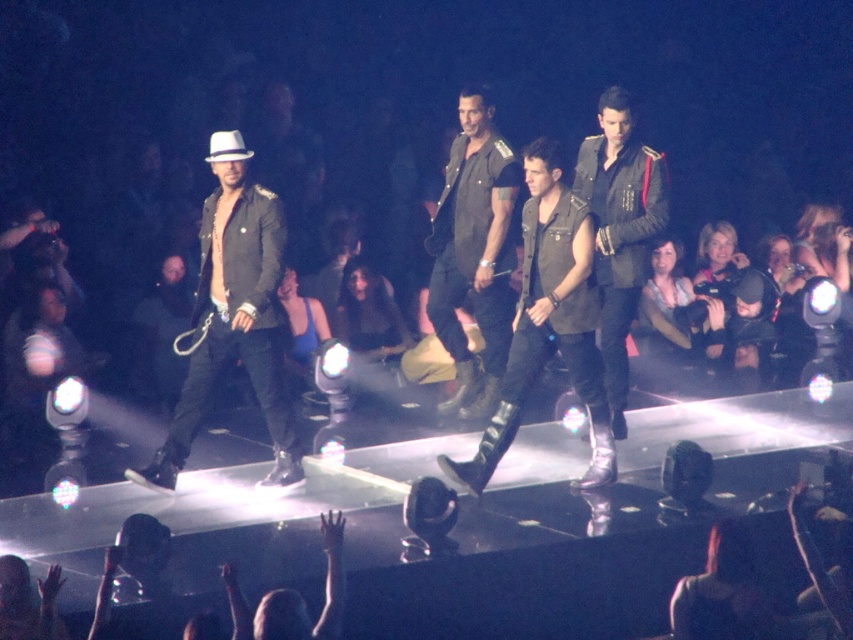
Is matte black boots at center above dark green military jacket at center?

No, matte black boots at center is not above dark green military jacket at center.

Which is behind, point (595, 336) or point (445, 182)?

The point (445, 182) is more distant.

Find the location of a particular element. The width and height of the screenshot is (853, 640). matte black boots at center is located at coordinates (548, 323).

Is matte black jacket at left wider than leather jacket at center?

Correct, the width of matte black jacket at left exceeds that of leather jacket at center.

Is point (234, 164) positioned before point (601, 305)?

Yes.

Is point (209, 209) positioned behind point (618, 259)?

No, it is in front of (618, 259).

Locate an element on the screen. The image size is (853, 640). matte black jacket at left is located at coordinates (233, 317).

Between matte black jacket at left and dark green military jacket at center, which one is positioned higher?

dark green military jacket at center

Is matte black jacket at left to the left of dark green military jacket at center from the viewer's perspective?

Yes, matte black jacket at left is to the left of dark green military jacket at center.

Does point (250, 352) come behind point (489, 353)?

No, it is not.

Where is `matte black jacket at left`? The image size is (853, 640). matte black jacket at left is located at coordinates (233, 317).